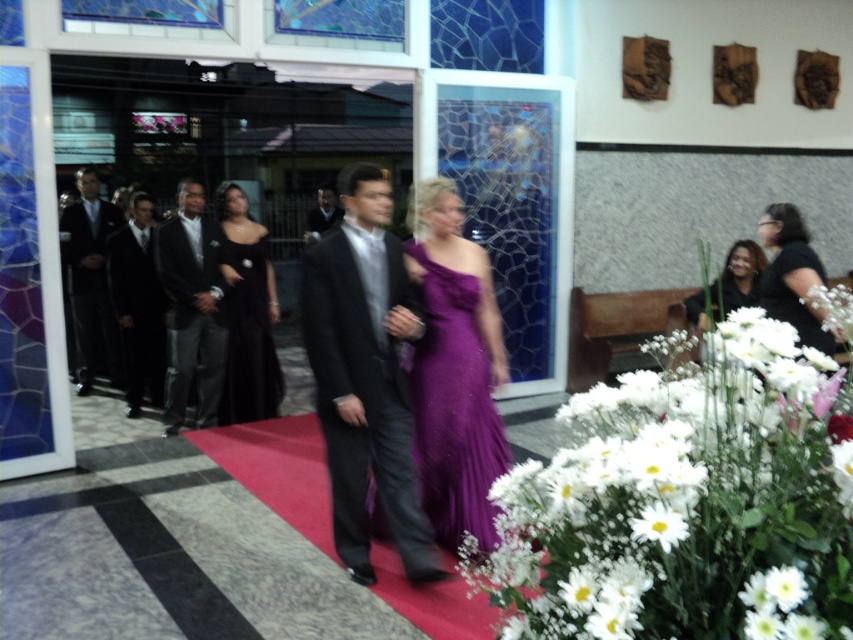
Question: Does shiny black suit at center have a larger size compared to matte black suit at center?

Choices:
 (A) no
 (B) yes

Answer: (B)

Question: Which point is farther to the camera?

Choices:
 (A) (141, 230)
 (B) (218, 188)
 (C) (790, 310)

Answer: (B)

Question: Can you confirm if shiny black suit at center is wider than black satin tuxedo at left?

Choices:
 (A) no
 (B) yes

Answer: (A)

Question: Among these points, which one is nearest to the camera?

Choices:
 (A) (422, 326)
 (B) (108, 316)

Answer: (A)

Question: Which of these objects is positioned closest to the black satin dress at lower right?

Choices:
 (A) purple satin dress at center
 (B) black satin suit at left

Answer: (A)

Question: Does white matte flowers at right appear over matte black suit at left?

Choices:
 (A) yes
 (B) no

Answer: (B)